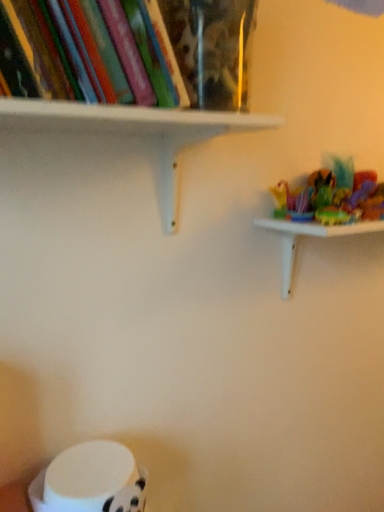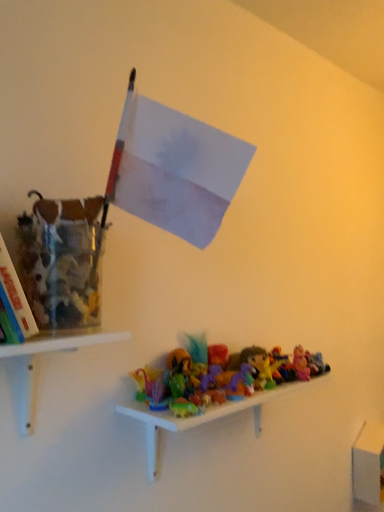
Question: How did the camera likely rotate when shooting the video?

Choices:
 (A) rotated upward
 (B) rotated downward

Answer: (A)